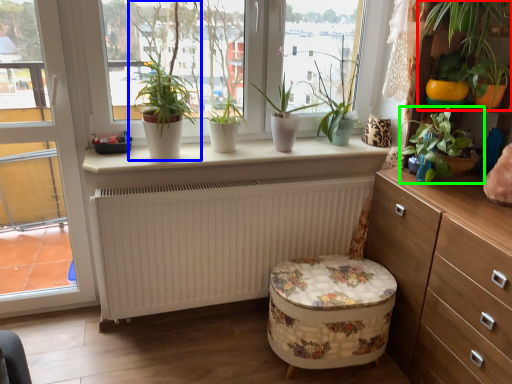
Question: Which is nearer to the houseplant (highlighted by a red box)? houseplant (highlighted by a blue box) or houseplant (highlighted by a green box).

Choices:
 (A) houseplant
 (B) houseplant

Answer: (B)